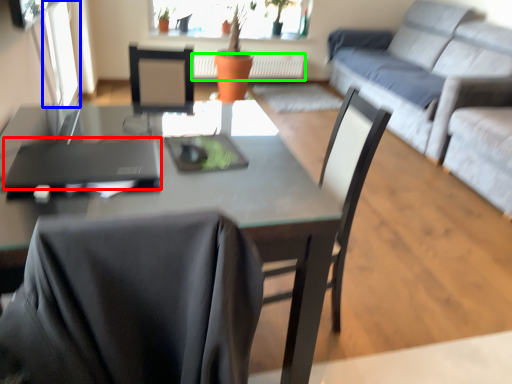
Question: Which object is positioned closest to laptop (highlighted by a red box)? Select from window screen (highlighted by a blue box) and radiator (highlighted by a green box).

Choices:
 (A) window screen
 (B) radiator

Answer: (A)